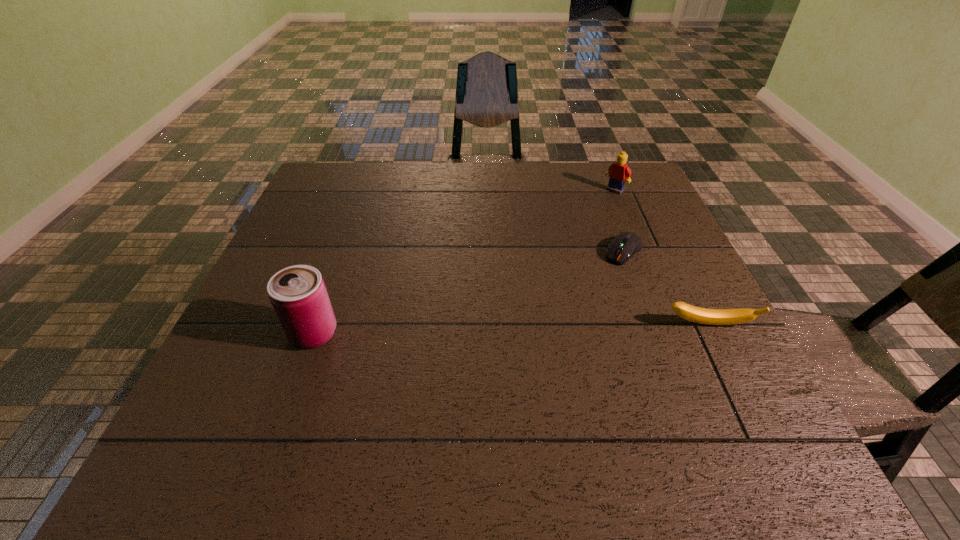
Locate an element on the screen. This screenshot has height=540, width=960. free spot on the desktop that is between the can and the banana and is positioned on the button of the shortest object is located at coordinates tap(557, 328).

Where is `free space on the desktop that is between the can and the banana and is positioned on the front-facing side of the farthest object`? This screenshot has width=960, height=540. free space on the desktop that is between the can and the banana and is positioned on the front-facing side of the farthest object is located at coordinates (473, 330).